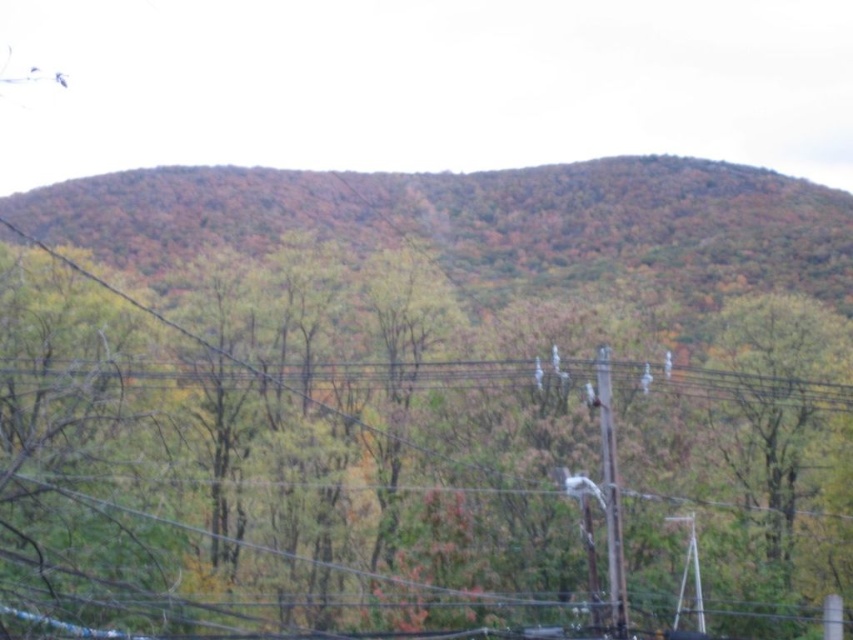
Between green matte tree at center and smooth wooden telegraph pole at right, which one has less height?

With less height is smooth wooden telegraph pole at right.

Does green matte tree at center have a greater width compared to smooth wooden telegraph pole at right?

Yes.

Who is more distant from viewer, (306, 420) or (602, 476)?

Point (306, 420)

Where is `green matte tree at center`? green matte tree at center is located at coordinates (281, 467).